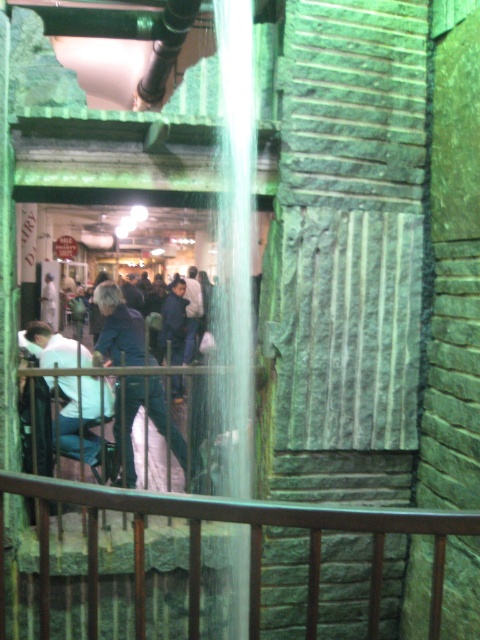
You are standing in front of the stone archway with a water feature. You notice a matte white shirt at center and a denim jacket at center hanging there. If you want to hang another item that is 1.2 meters wide, which of the two garments can accommodate it without overlapping?

The matte white shirt at center has a larger width than the denim jacket at center, so the 1.2 meters wide item can be placed next to or under the matte white shirt at center without overlapping.

You are standing in front of the stone archway and see the denim jacket at center and the light blue jeans at center. Which item is closer to you?

The denim jacket at center is closer to you because the light blue jeans at center is behind it.